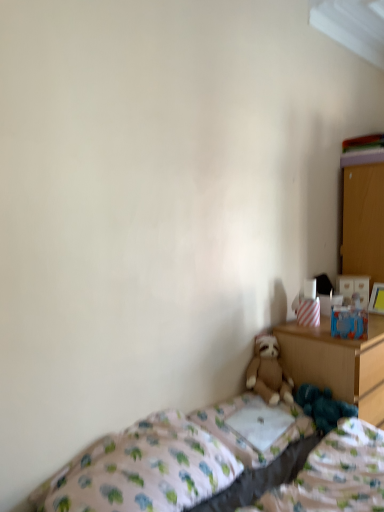
Find the location of `dark blue plush at lower right`. dark blue plush at lower right is located at coordinates (323, 407).

Where is `dark blue plush at lower right`? The width and height of the screenshot is (384, 512). dark blue plush at lower right is located at coordinates (x=323, y=407).

From the picture: In terms of width, does wooden dresser at right look wider or thinner when compared to brown plush teddy bear at lower center?

Considering their sizes, wooden dresser at right looks broader than brown plush teddy bear at lower center.

Considering the relative positions of wooden dresser at right and brown plush teddy bear at lower center in the image provided, is wooden dresser at right to the left of brown plush teddy bear at lower center from the viewer's perspective?

No, wooden dresser at right is not to the left of brown plush teddy bear at lower center.

Based on the photo, is wooden dresser at right not close to brown plush teddy bear at lower center?

wooden dresser at right is positioned a significant distance from brown plush teddy bear at lower center.

Is brown plush teddy bear at lower center completely or partially inside wooden dresser at right?

No, brown plush teddy bear at lower center is not inside wooden dresser at right.

Is wooden dresser at right wider than dark blue plush at lower right?

No, wooden dresser at right is not wider than dark blue plush at lower right.

How many degrees apart are the facing directions of wooden dresser at right and dark blue plush at lower right?

0.775 degrees.

Where is `toy that is in front of the wooden dresser at right`? Image resolution: width=384 pixels, height=512 pixels. toy that is in front of the wooden dresser at right is located at coordinates (323, 407).

Is dark blue plush at lower right surrounded by wooden dresser at right?

No, dark blue plush at lower right is not inside wooden dresser at right.

In the scene shown: Who is taller, dark blue plush at lower right or white fabric pillow at center?

dark blue plush at lower right.

Between dark blue plush at lower right and white fabric pillow at center, which one has smaller size?

white fabric pillow at center.

From the image's perspective, which is below, dark blue plush at lower right or white fabric pillow at center?

From the image's view, white fabric pillow at center is below.

The image size is (384, 512). I want to click on toy on the right of white fabric pillow at center, so click(323, 407).

Looking at this image, from a real-world perspective, who is located lower, wooden nightstand at right or white fabric pillow at center?

wooden nightstand at right, from a real-world perspective.

Relative to white fabric pillow at center, is wooden nightstand at right in front or behind?

wooden nightstand at right is behind white fabric pillow at center.

Is wooden nightstand at right aimed at white fabric pillow at center?

No, wooden nightstand at right does not turn towards white fabric pillow at center.

Would you say brown plush teddy bear at lower center is to the left or to the right of wooden dresser at right in the picture?

In the image, brown plush teddy bear at lower center appears on the left side of wooden dresser at right.

Does point (283, 395) come closer to viewer compared to point (374, 175)?

Yes, point (283, 395) is closer to viewer.

Considering the relative positions of dark blue plush at lower right and fluffy brown teddy bear at lower right in the image provided, is dark blue plush at lower right to the left of fluffy brown teddy bear at lower right from the viewer's perspective?

No.

Does point (316, 417) come in front of point (226, 411)?

That is False.

From a real-world perspective, which is physically above, dark blue plush at lower right or fluffy brown teddy bear at lower right?

dark blue plush at lower right is physically above.

Is dark blue plush at lower right bigger than fluffy brown teddy bear at lower right?

No.

Is brown plush teddy bear at lower center outside of patterned fabric bed at lower right?

Yes.

Can you tell me how much brown plush teddy bear at lower center and patterned fabric bed at lower right differ in facing direction?

36.6 degrees separate the facing orientations of brown plush teddy bear at lower center and patterned fabric bed at lower right.

From the picture: Is brown plush teddy bear at lower center oriented towards patterned fabric bed at lower right?

No, brown plush teddy bear at lower center is not turned towards patterned fabric bed at lower right.

Would you say brown plush teddy bear at lower center is a long distance from patterned fabric bed at lower right?

No.

Locate an element on the screen. teddy bear below the wooden dresser at right (from the image's perspective) is located at coordinates point(269,372).

Find the location of a particular element. dresser on the right of the dark blue plush at lower right is located at coordinates (363, 207).

From the image, which object appears to be nearer to wooden nightstand at right, dark blue plush at lower right or fluffy brown teddy bear at lower right?

Among the two, dark blue plush at lower right is located nearer to wooden nightstand at right.

When comparing their distances from patterned fabric bed at lower right, does wooden nightstand at right or wooden dresser at right seem closer?

wooden nightstand at right lies closer to patterned fabric bed at lower right than the other object.

From the image, which object appears to be farther from dark blue plush at lower right, wooden dresser at right or fluffy brown teddy bear at lower right?

wooden dresser at right lies further to dark blue plush at lower right than the other object.

Which object lies nearer to the anchor point brown plush teddy bear at lower center, wooden dresser at right or wooden nightstand at right?

wooden nightstand at right lies closer to brown plush teddy bear at lower center than the other object.

Considering their positions, is white fabric pillow at center positioned further to wooden dresser at right than wooden nightstand at right?

Based on the image, white fabric pillow at center appears to be further to wooden dresser at right.

When comparing their distances from white fabric pillow at center, does wooden dresser at right or fluffy brown teddy bear at lower right seem closer?

fluffy brown teddy bear at lower right is closer to white fabric pillow at center.

Based on the photo, which object lies nearer to the anchor point brown plush teddy bear at lower center, patterned fabric bed at lower right or fluffy brown teddy bear at lower right?

Among the two, fluffy brown teddy bear at lower right is located nearer to brown plush teddy bear at lower center.

Estimate the real-world distances between objects in this image. Which object is closer to white fabric pillow at center, dark blue plush at lower right or fluffy brown teddy bear at lower right?

fluffy brown teddy bear at lower right.

Locate an element on the screen. teddy bear situated between white fabric pillow at center and dark blue plush at lower right from left to right is located at coordinates (269, 372).

I want to click on pillow positioned between fluffy brown teddy bear at lower right and brown plush teddy bear at lower center from near to far, so click(260, 424).

Identify the location of nightstand situated between white fabric pillow at center and wooden dresser at right from left to right. The height and width of the screenshot is (512, 384). tap(338, 362).

Where is `teddy bear situated between white fabric pillow at center and wooden dresser at right from left to right`? This screenshot has width=384, height=512. teddy bear situated between white fabric pillow at center and wooden dresser at right from left to right is located at coordinates (269, 372).